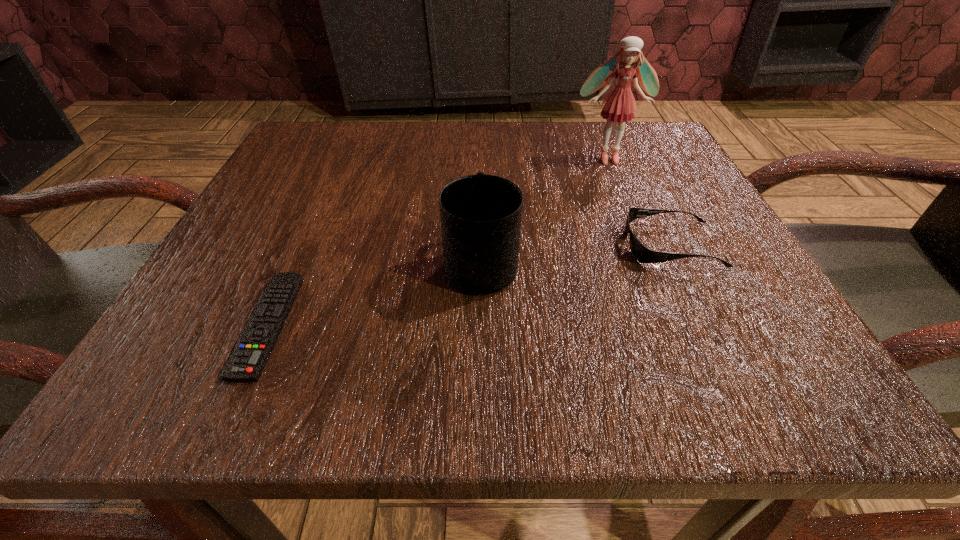
You are a GUI agent. You are given a task and a screenshot of the screen. Output one action in this format:
    pyautogui.click(x=<x>, y=<y>)
    Task: Click on the object that stands as the third closest to the second shortest object
    
    Given the screenshot: What is the action you would take?
    pyautogui.click(x=246, y=363)

Find the location of `vacant space that satisfies the following two spatial constraints: 1. on the front-facing side of the second shortest object; 2. on the front side of the shortest object`. vacant space that satisfies the following two spatial constraints: 1. on the front-facing side of the second shortest object; 2. on the front side of the shortest object is located at coordinates (710, 324).